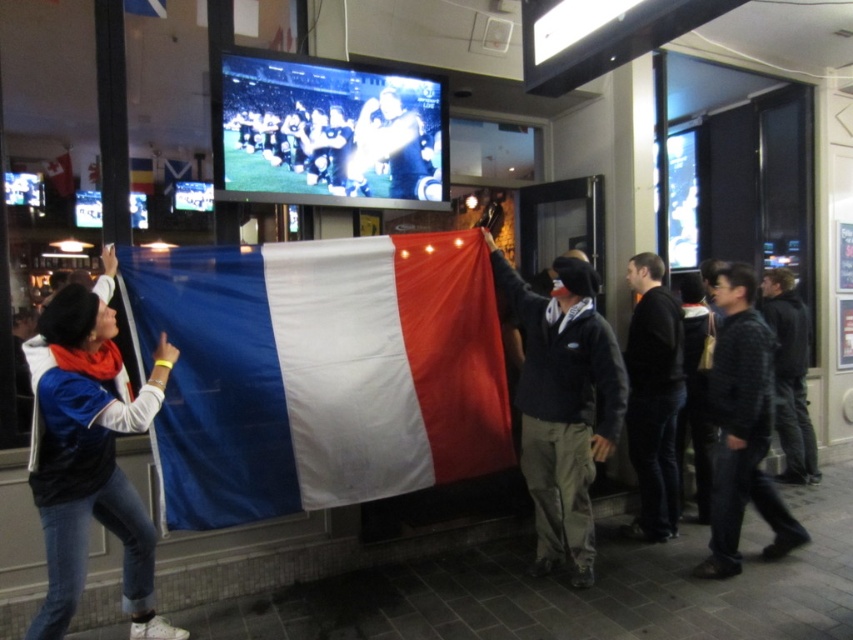
Question: Observing the image, what is the correct spatial positioning of dark gray fleece jacket at center in reference to dark gray textured sweater at right?

Choices:
 (A) above
 (B) below

Answer: (A)

Question: Which object is positioned closest to the dark gray textured sweater at right?

Choices:
 (A) black smooth jacket at right
 (B) matte fabric flag at center
 (C) dark gray fleece jacket at center
 (D) dark gray hoodie at right

Answer: (A)

Question: Is dark gray fleece jacket at center thinner than black smooth jacket at right?

Choices:
 (A) no
 (B) yes

Answer: (A)

Question: Which point is farther from the camera taking this photo?

Choices:
 (A) (775, 276)
 (B) (308, 385)

Answer: (A)

Question: Does dark gray fleece jacket at center appear over dark gray hoodie at right?

Choices:
 (A) no
 (B) yes

Answer: (B)

Question: Which object is positioned farthest from the dark gray hoodie at right?

Choices:
 (A) blue fabric flag at left
 (B) dark gray textured sweater at right

Answer: (A)